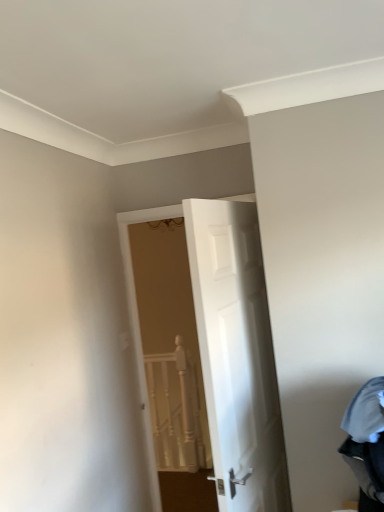
The width and height of the screenshot is (384, 512). Describe the element at coordinates (236, 351) in the screenshot. I see `white glossy door at center` at that location.

Image resolution: width=384 pixels, height=512 pixels. I want to click on white textured rail at center, so click(x=175, y=410).

The width and height of the screenshot is (384, 512). What do you see at coordinates (366, 438) in the screenshot?
I see `denim fabric laundry at lower right` at bounding box center [366, 438].

Locate an element on the screen. The width and height of the screenshot is (384, 512). white glossy door at center is located at coordinates (236, 351).

The width and height of the screenshot is (384, 512). In order to click on laundry in front of the white glossy door at center in this screenshot , I will do `click(366, 438)`.

Is white glossy door at center further to the viewer compared to denim fabric laundry at lower right?

Yes, white glossy door at center is further from the viewer.

Based on the photo, is white glossy door at center thinner than denim fabric laundry at lower right?

Yes, white glossy door at center is thinner than denim fabric laundry at lower right.

Is white glossy door at center looking in the opposite direction of white textured rail at center?

No, white glossy door at center's orientation is not away from white textured rail at center.

Who is more distant, white glossy door at center or white textured rail at center?

white textured rail at center is further away from the camera.

From a real-world perspective, which object rests below the other?

From a 3D spatial view, white textured rail at center is below.

Looking at the image, does white glossy door at center seem bigger or smaller compared to white textured rail at center?

Clearly, white glossy door at center is larger in size than white textured rail at center.

Is point (180, 455) closer or farther from the camera than point (234, 310)?

Point (180, 455) is farther from the camera than point (234, 310).

Identify the location of door on the right of white textured rail at center. (236, 351).

How many degrees apart are the facing directions of white textured rail at center and white glossy door at center?

106 degrees separate the facing orientations of white textured rail at center and white glossy door at center.

From a real-world perspective, who is located lower, denim fabric laundry at lower right or white glossy door at center?

From a 3D spatial view, denim fabric laundry at lower right is below.

Is denim fabric laundry at lower right facing away from white glossy door at center?

That's not correct — denim fabric laundry at lower right is not looking away from white glossy door at center.

Based on their sizes in the image, would you say denim fabric laundry at lower right is bigger or smaller than white glossy door at center?

Considering their sizes, denim fabric laundry at lower right takes up less space than white glossy door at center.

Is white textured rail at center located outside denim fabric laundry at lower right?

Yes, white textured rail at center is outside of denim fabric laundry at lower right.

Does white textured rail at center have a larger size compared to denim fabric laundry at lower right?

No, white textured rail at center is not bigger than denim fabric laundry at lower right.

In terms of width, does white textured rail at center look wider or thinner when compared to denim fabric laundry at lower right?

In the image, white textured rail at center appears to be more narrow than denim fabric laundry at lower right.

I want to click on laundry on the right of white textured rail at center, so [x=366, y=438].

Is point (373, 500) closer or farther from the camera than point (159, 379)?

Point (373, 500) is positioned closer to the camera compared to point (159, 379).

Does denim fabric laundry at lower right appear on the right side of white textured rail at center?

Correct, you'll find denim fabric laundry at lower right to the right of white textured rail at center.

Considering the sizes of objects denim fabric laundry at lower right and white textured rail at center in the image provided, who is smaller, denim fabric laundry at lower right or white textured rail at center?

white textured rail at center is smaller.

Considering the relative sizes of denim fabric laundry at lower right and white textured rail at center in the image provided, is denim fabric laundry at lower right thinner than white textured rail at center?

No, denim fabric laundry at lower right is not thinner than white textured rail at center.

Where is `laundry located below the white glossy door at center (from the image's perspective)`? laundry located below the white glossy door at center (from the image's perspective) is located at coordinates (366, 438).

Locate an element on the screen. door that is in front of the white textured rail at center is located at coordinates (236, 351).

Estimate the real-world distances between objects in this image. Which object is closer to white glossy door at center, white textured rail at center or denim fabric laundry at lower right?

denim fabric laundry at lower right.

Which object lies further to the anchor point denim fabric laundry at lower right, white textured rail at center or white glossy door at center?

white textured rail at center.

Considering their positions, is denim fabric laundry at lower right positioned closer to white textured rail at center than white glossy door at center?

Among the two, white glossy door at center is located nearer to white textured rail at center.

From the image, which object appears to be farther from denim fabric laundry at lower right, white glossy door at center or white textured rail at center?

Among the two, white textured rail at center is located further to denim fabric laundry at lower right.

When comparing their distances from white textured rail at center, does white glossy door at center or denim fabric laundry at lower right seem closer?

white glossy door at center is positioned closer to the anchor white textured rail at center.

Considering their positions, is denim fabric laundry at lower right positioned further to white glossy door at center than white textured rail at center?

Based on the image, white textured rail at center appears to be further to white glossy door at center.

You are a GUI agent. You are given a task and a screenshot of the screen. Output one action in this format:
    pyautogui.click(x=<x>, y=<y>)
    Task: Click on the door located between denim fabric laundry at lower right and white textured rail at center in the depth direction
    This screenshot has height=512, width=384.
    Given the screenshot: What is the action you would take?
    pyautogui.click(x=236, y=351)